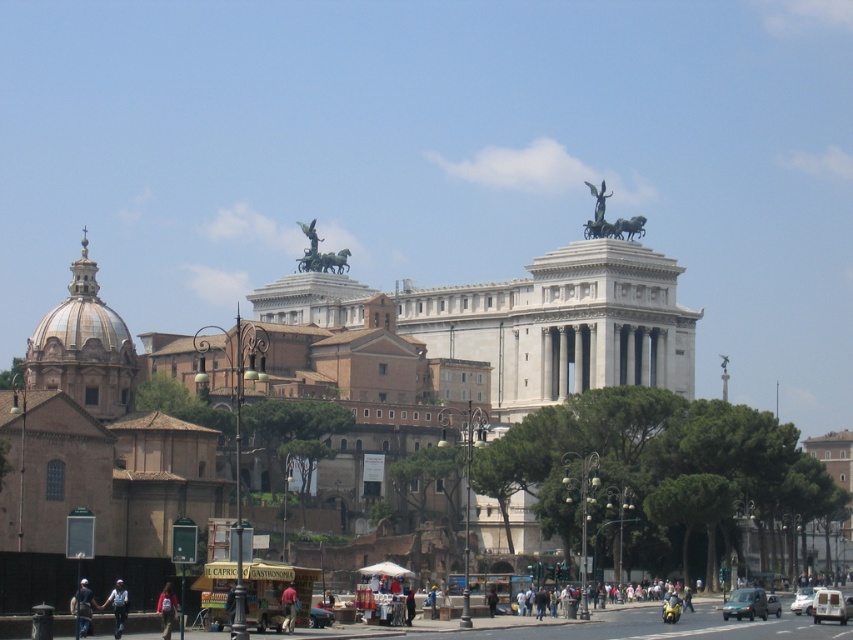
Does light brown leather jacket at lower center have a lesser width compared to white glossy car at center?

No.

Who is more forward, (679, 604) or (804, 605)?

Point (679, 604) is more forward.

Is point (630, 596) less distant than point (798, 608)?

No.

Where is `light brown leather jacket at lower center`? The height and width of the screenshot is (640, 853). light brown leather jacket at lower center is located at coordinates (614, 595).

Is green matte van at center further to camera compared to bronze/golden statue at upper center?

That is False.

Does point (753, 589) lie behind point (306, 236)?

No.

This screenshot has height=640, width=853. Find the location of `green matte van at center`. green matte van at center is located at coordinates (749, 604).

Which is in front, point (120, 627) or point (488, 600)?

Point (120, 627) is more forward.

Who is shorter, light blue jeans at lower left or black leather jacket at center?

Standing shorter between the two is black leather jacket at center.

Image resolution: width=853 pixels, height=640 pixels. Find the location of `light blue jeans at lower left`. light blue jeans at lower left is located at coordinates pyautogui.click(x=117, y=605).

What are the coordinates of `light blue jeans at lower left` in the screenshot? It's located at pyautogui.click(x=117, y=605).